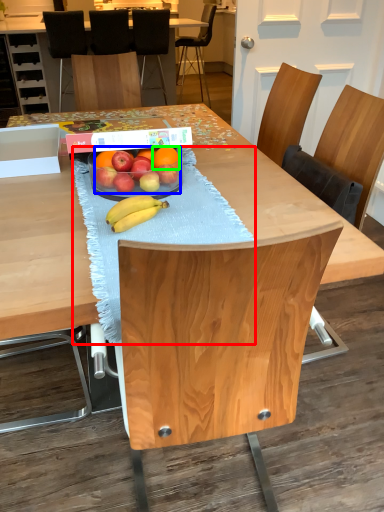
Question: Which object is the closest to the tablecloth (highlighted by a red box)? Choose among these: grapefruit (highlighted by a blue box) or orange (highlighted by a green box).

Choices:
 (A) grapefruit
 (B) orange

Answer: (A)